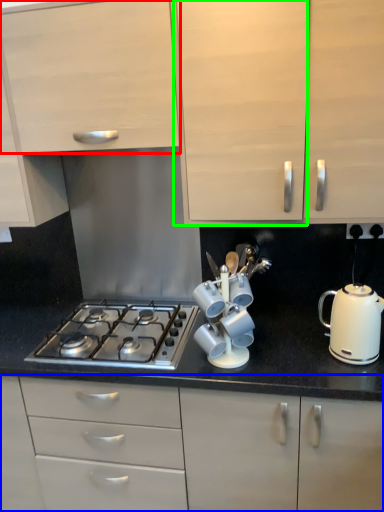
Question: Which object is the closest to the cabinetry (highlighted by a red box)? Choose among these: cabinetry (highlighted by a blue box) or cabinetry (highlighted by a green box).

Choices:
 (A) cabinetry
 (B) cabinetry

Answer: (B)